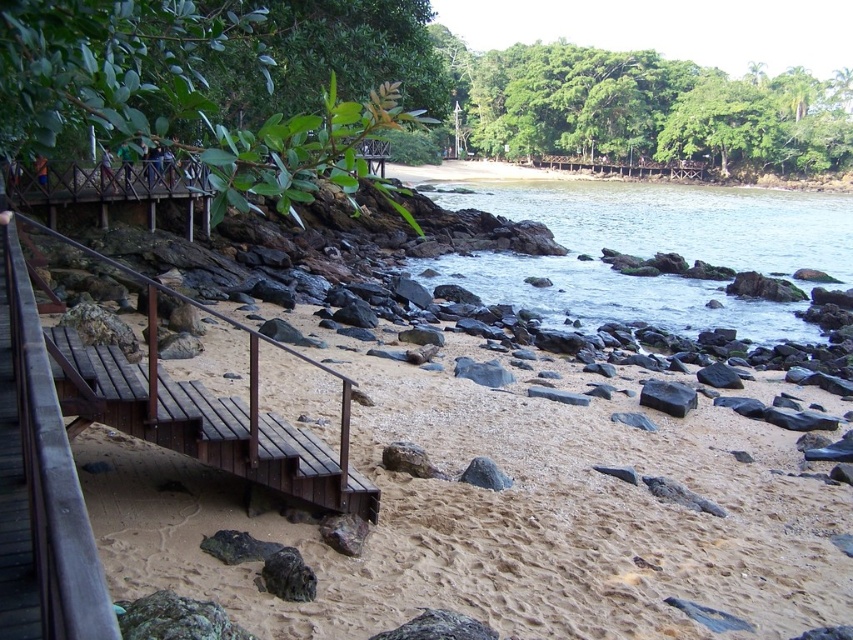
Does sandy beach at lower left appear over gray rock at center?

Yes, sandy beach at lower left is above gray rock at center.

How much distance is there between sandy beach at lower left and gray rock at center?

sandy beach at lower left and gray rock at center are 6.46 feet apart.

Describe the element at coordinates (386, 500) in the screenshot. I see `sandy beach at lower left` at that location.

Locate an element on the screen. This screenshot has height=640, width=853. sandy beach at lower left is located at coordinates (386, 500).

Does brown wooden rail at left appear under black smooth rock at center?

No, brown wooden rail at left is not below black smooth rock at center.

Which is behind, point (238, 408) or point (668, 413)?

The point (668, 413) is more distant.

In order to click on brown wooden rail at left in this screenshot , I will do `click(204, 413)`.

Identify the location of brown wooden rail at left. Image resolution: width=853 pixels, height=640 pixels. click(x=204, y=413).

Is brown wooden rail at left bigger than gray rock at center?

Yes, brown wooden rail at left is bigger than gray rock at center.

Does point (54, 349) lie behind point (488, 486)?

No, (54, 349) is closer to viewer.

The image size is (853, 640). What are the coordinates of `brown wooden rail at left` in the screenshot? It's located at (204, 413).